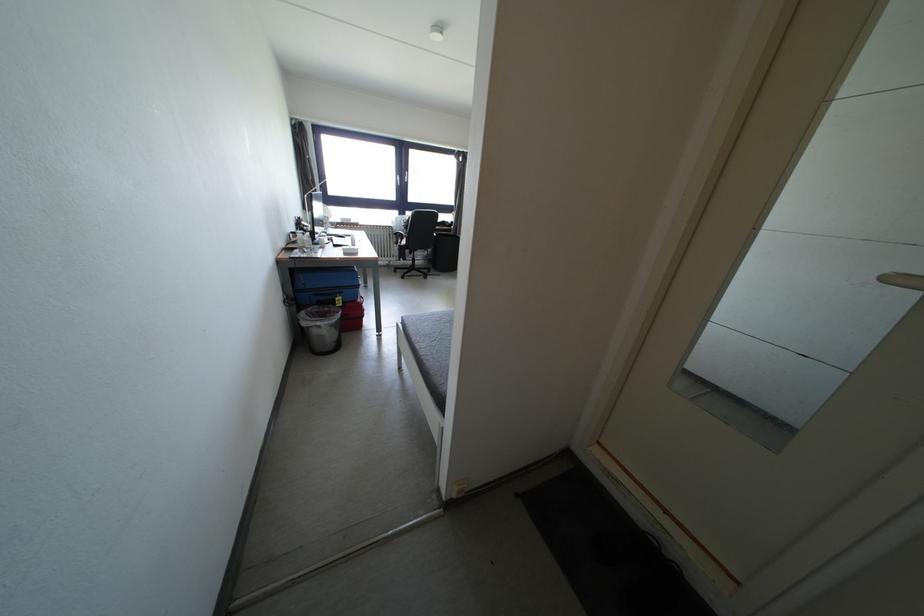
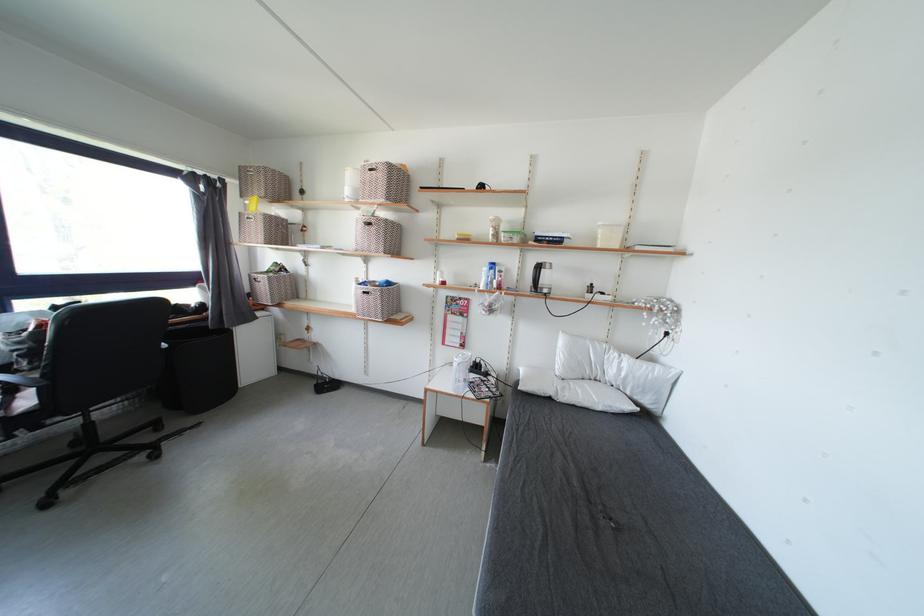
The point at [410,246] is marked in the first image. Where is the corresponding point in the second image?

(33, 407)